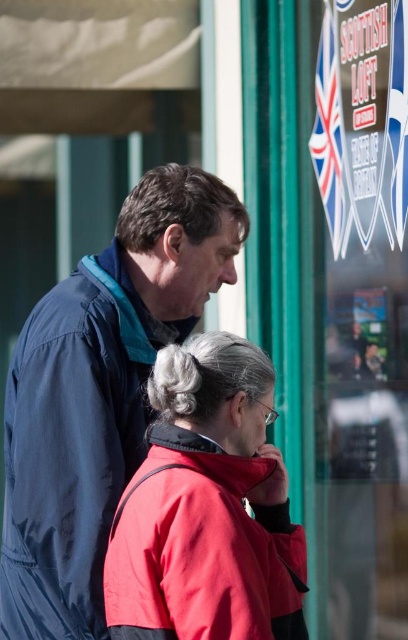
You are standing in front of the Scottish Loft storefront. You see a point at coordinates (99, 392). What object is located at that point?

The point at (99, 392) corresponds to the matte blue jacket at center.

You are a photographer wanting to capture both the matte blue jacket at center and the red matte jacket at lower center in one frame. Which jacket should you focus on first to ensure both are in focus?

The matte blue jacket at center is closer to the viewer than the red matte jacket at lower center. To ensure both are in focus, focus on the matte blue jacket at center first, as it is closer, and the depth of field will likely include the farther red matte jacket at lower center.